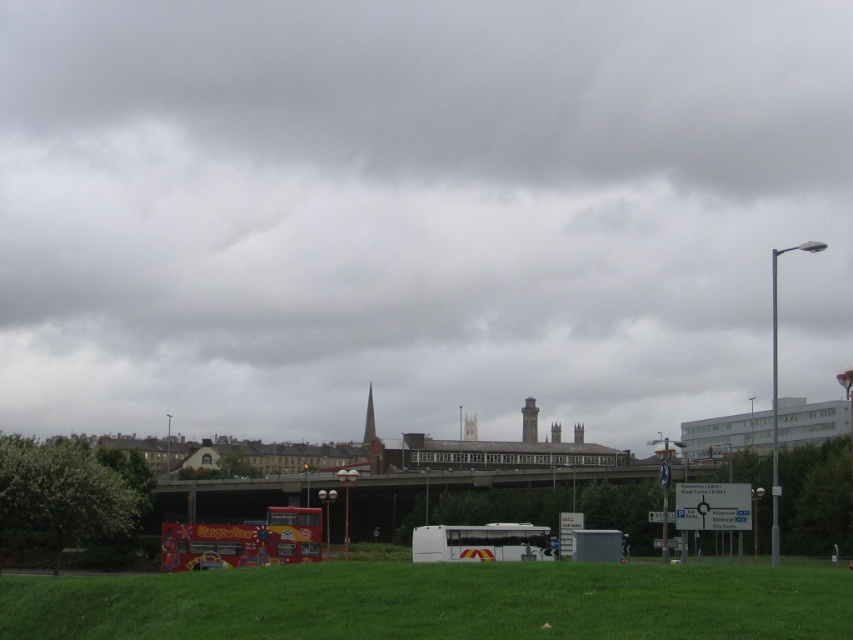
Question: Is gray cloudy sky at upper center wider than white matte bus at center?

Choices:
 (A) yes
 (B) no

Answer: (A)

Question: Which point is farther from the camera taking this photo?

Choices:
 (A) (515, 616)
 (B) (440, 410)
 (C) (463, 547)

Answer: (B)

Question: Can you confirm if green grass at lower center is thinner than white matte bus at center?

Choices:
 (A) yes
 (B) no

Answer: (B)

Question: Can you confirm if gray cloudy sky at upper center is positioned to the left of white matte bus at center?

Choices:
 (A) no
 (B) yes

Answer: (B)

Question: Which object is farther from the camera taking this photo?

Choices:
 (A) green grass at lower center
 (B) white matte bus at center

Answer: (B)

Question: Which of the following is the farthest from the observer?

Choices:
 (A) green grass at lower center
 (B) white matte bus at center
 (C) gray cloudy sky at upper center

Answer: (C)